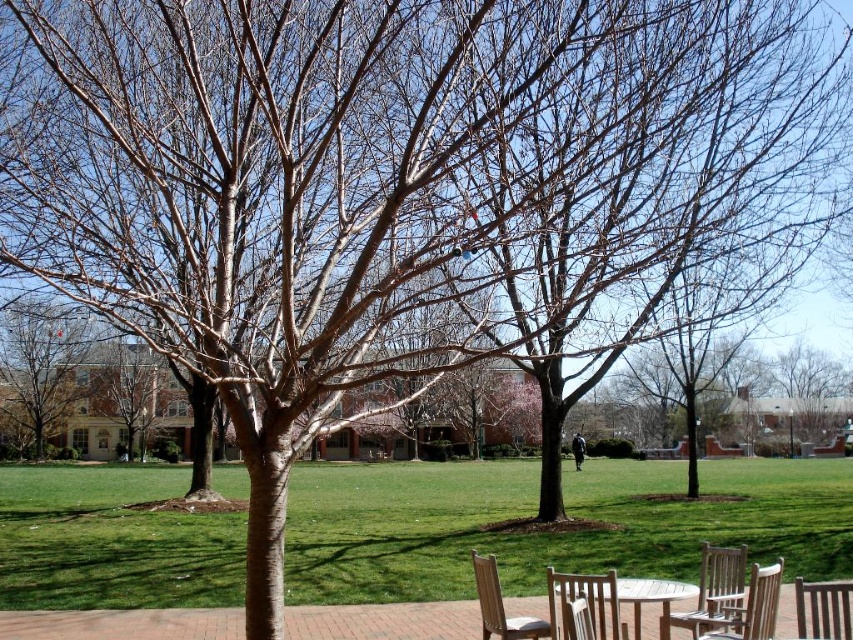
Who is lower down, wooden chair at lower right or light brown wood picnic table at lower center?

light brown wood picnic table at lower center

Can you confirm if wooden chair at lower right is wider than light brown wood picnic table at lower center?

No, wooden chair at lower right is not wider than light brown wood picnic table at lower center.

Where is `wooden chair at lower right`? This screenshot has height=640, width=853. wooden chair at lower right is located at coordinates (585, 602).

The width and height of the screenshot is (853, 640). Find the location of `wooden chair at lower right`. wooden chair at lower right is located at coordinates pos(585,602).

Does point (614, 632) come behind point (757, 609)?

No, it is not.

Looking at this image, between wooden chair at lower right and teak wood chair at lower right, which one appears on the right side from the viewer's perspective?

teak wood chair at lower right is more to the right.

Is point (606, 625) less distant than point (721, 636)?

No, it is not.

Image resolution: width=853 pixels, height=640 pixels. In order to click on wooden chair at lower right in this screenshot , I will do `click(585, 602)`.

Is light brown wooden chair at lower right to the right of light brown wood picnic table at lower center from the viewer's perspective?

Indeed, light brown wooden chair at lower right is positioned on the right side of light brown wood picnic table at lower center.

Between light brown wooden chair at lower right and light brown wood picnic table at lower center, which one has more height?

light brown wood picnic table at lower center is taller.

Where is `light brown wooden chair at lower right`? Image resolution: width=853 pixels, height=640 pixels. light brown wooden chair at lower right is located at coordinates (712, 593).